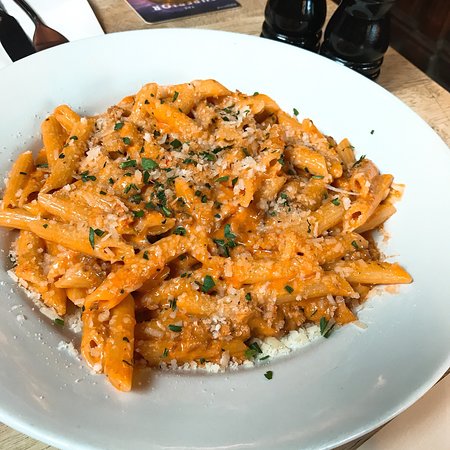
Locate an element on the screen. The width and height of the screenshot is (450, 450). salt and pepper shakers is located at coordinates (363, 44), (301, 12).